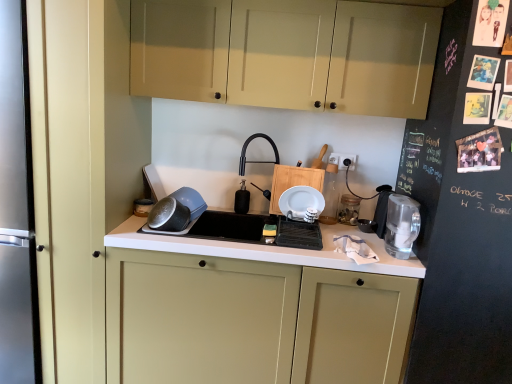
This screenshot has width=512, height=384. I want to click on vacant space in between black matte soap dispenser at center, marked as the second appliance in a left-to-right arrangement, and black matte faucet at center, so click(249, 216).